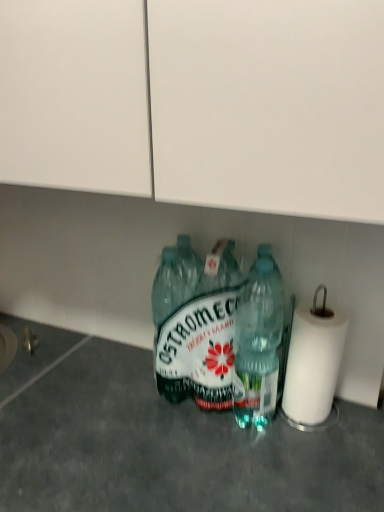
Question: Considering the relative sizes of white paper at right and transparent plastic bottles at center in the image provided, is white paper at right thinner than transparent plastic bottles at center?

Choices:
 (A) yes
 (B) no

Answer: (A)

Question: Is white paper at right positioned beyond the bounds of transparent plastic bottles at center?

Choices:
 (A) yes
 (B) no

Answer: (A)

Question: Is white paper at right turned away from transparent plastic bottles at center?

Choices:
 (A) no
 (B) yes

Answer: (A)

Question: Could you tell me if white paper at right is turned towards transparent plastic bottles at center?

Choices:
 (A) yes
 (B) no

Answer: (B)

Question: Does white paper at right have a greater height compared to transparent plastic bottles at center?

Choices:
 (A) no
 (B) yes

Answer: (A)

Question: Is the depth of white paper at right greater than that of transparent plastic bottles at center?

Choices:
 (A) no
 (B) yes

Answer: (B)

Question: From a real-world perspective, is green plastic bottle at center, which ranks as the second bottle in right-to-left order, positioned over white paper at right based on gravity?

Choices:
 (A) no
 (B) yes

Answer: (B)

Question: From the image's perspective, is green plastic bottle at center, which appears as the first bottle when viewed from the left, on top of white paper at right?

Choices:
 (A) yes
 (B) no

Answer: (A)

Question: Does green plastic bottle at center, which ranks as the second bottle in right-to-left order, appear on the right side of white paper at right?

Choices:
 (A) yes
 (B) no

Answer: (B)

Question: Is green plastic bottle at center, which appears as the first bottle when viewed from the left, far away from white paper at right?

Choices:
 (A) no
 (B) yes

Answer: (A)

Question: Is green plastic bottle at center, which appears as the first bottle when viewed from the left, taller than white paper at right?

Choices:
 (A) yes
 (B) no

Answer: (A)

Question: Is green plastic bottle at center, which ranks as the second bottle in right-to-left order, thinner than white paper at right?

Choices:
 (A) no
 (B) yes

Answer: (A)

Question: From a real-world perspective, does transparent plastic bottles at center sit lower than white paper at right?

Choices:
 (A) yes
 (B) no

Answer: (A)